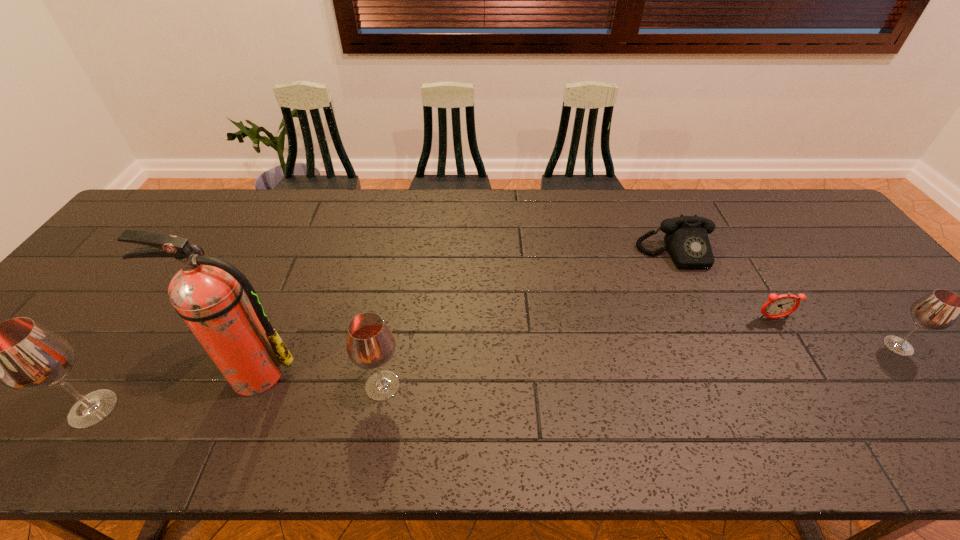
If equal spacing is the goal by inserting an additional wineglass among them, please point out a vacant space for this new wineglass. Please provide its 2D coordinates. Your answer should be formatted as a tuple, i.e. [(x, y)], where the tuple contains the x and y coordinates of a point satisfying the conditions above.

[(650, 365)]